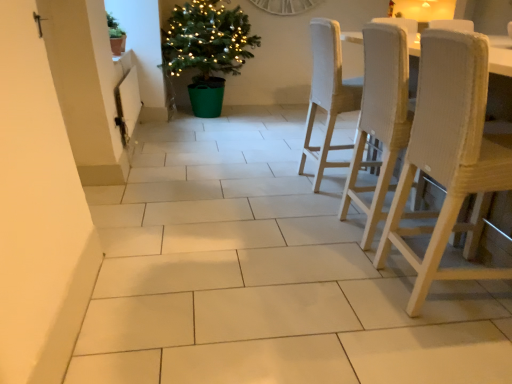
Question: Is woven fabric chair at right, the 2th chair viewed from the front, in front of or behind white textured wood chair at right, which is the 1th chair from front to back, in the image?

Choices:
 (A) front
 (B) behind

Answer: (B)

Question: Based on their positions, is woven fabric chair at right, acting as the second chair starting from the back, located to the left or right of white textured wood chair at right, which is the 1th chair from front to back?

Choices:
 (A) left
 (B) right

Answer: (A)

Question: Which object is the farthest from the matte brown pot at upper left?

Choices:
 (A) white textured wood chair at right, which is the 1th chair from front to back
 (B) green matte pot at upper left, positioned as the second houseplant in back-to-front order
 (C) woven fabric chair at right, acting as the second chair starting from the back
 (D) green plastic potted plant at center-left, which appears as the 2th houseplant when viewed from the left
 (E) light beige woven chair at center right, the 1th chair viewed from the back

Answer: (A)

Question: Which object is the farthest from the green matte pot at upper left, marked as the 1th houseplant in a front-to-back arrangement?

Choices:
 (A) white textured wood chair at right, which is the 1th chair from front to back
 (B) light beige woven chair at center right, the 3th chair in the front-to-back sequence
 (C) green plastic potted plant at center-left, which appears as the 2th houseplant when viewed from the front
 (D) woven fabric chair at right, the 2th chair viewed from the front
 (E) matte brown pot at upper left

Answer: (A)